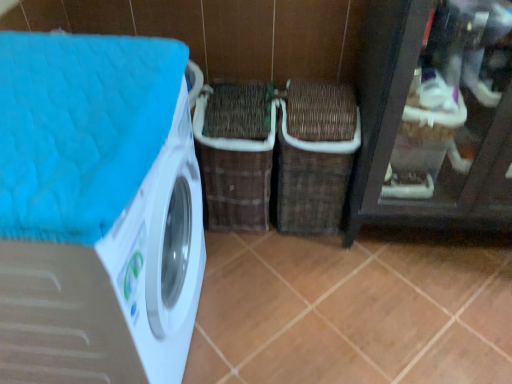
Question: Does point (351, 162) appear closer or farther from the camera than point (247, 190)?

Choices:
 (A) closer
 (B) farther

Answer: (A)

Question: Considering the positions of woven brown basket at center, which is counted as the 2th basket, starting from the left, and brown woven basket at center, placed as the first basket when sorted from left to right, in the image, is woven brown basket at center, which is counted as the 2th basket, starting from the left, wider or thinner than brown woven basket at center, placed as the first basket when sorted from left to right,?

Choices:
 (A) wide
 (B) thin

Answer: (B)

Question: Which object is positioned closest to the woven brown basket at center, positioned as the 1th basket in right-to-left order?

Choices:
 (A) white glossy washing machine at left
 (B) brown matte tile at center
 (C) brown woven basket at center, placed as the first basket when sorted from left to right

Answer: (C)

Question: Estimate the real-world distances between objects in this image. Which object is farther from the brown matte tile at center?

Choices:
 (A) woven brown basket at center, positioned as the 1th basket in right-to-left order
 (B) white glossy washing machine at left
 (C) brown woven basket at center, placed as the second basket when sorted from right to left

Answer: (B)